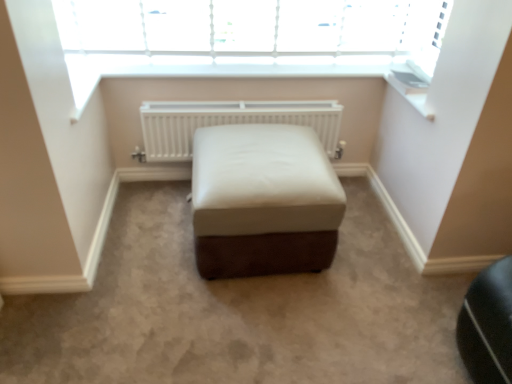
I want to click on free space above white leather ottoman at center (from a real-world perspective), so pyautogui.click(x=258, y=148).